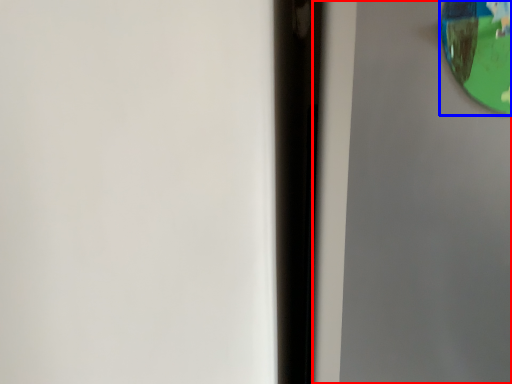
Question: Which point is further to the camera, screen door (highlighted by a red box) or view mirror (highlighted by a blue box)?

Choices:
 (A) screen door
 (B) view mirror

Answer: (B)